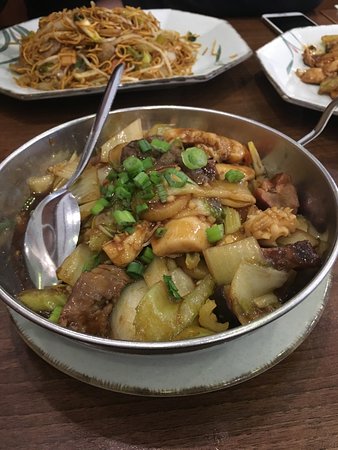
Locate an element on the screen. The image size is (338, 450). plate is located at coordinates (185, 384).